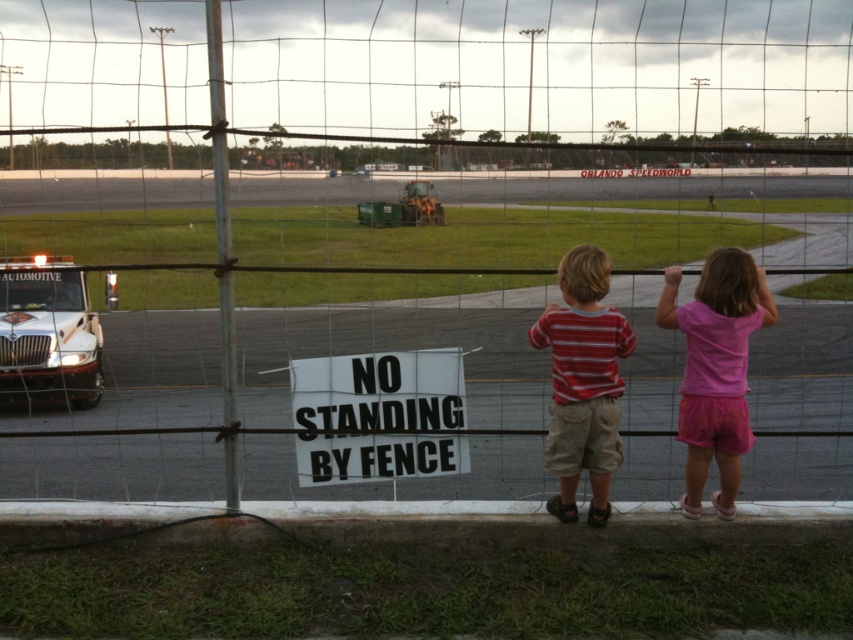
You are a visitor at Orlando Speedworld racetrack and see the white paper sign at center and the striped cotton shirt at center. Which object is smaller in size?

The white paper sign at center is smaller than the striped cotton shirt at center according to the description.

You are a safety inspector at Orlando Speedworld and need to ensure that the white paper sign at center and the striped cotton shirt at center are at least 1 meter apart to comply with safety regulations. Based on the scene, can you confirm if they meet the required distance?

The white paper sign at center and the striped cotton shirt at center are 87.30 centimeters apart, which is less than the required 1 meter. Therefore, they do not meet the safety regulation distance requirement.

You are standing at the fence at Orlando Speedworld and want to take a photo of the two children. The boy is at point (461, 452) and the girl is at point (619, 381). Which child should you focus on first to ensure both are in the frame?

You should focus on the boy at point (461, 452) first because he is closer to you than the girl at point (619, 381), ensuring both are in the frame.